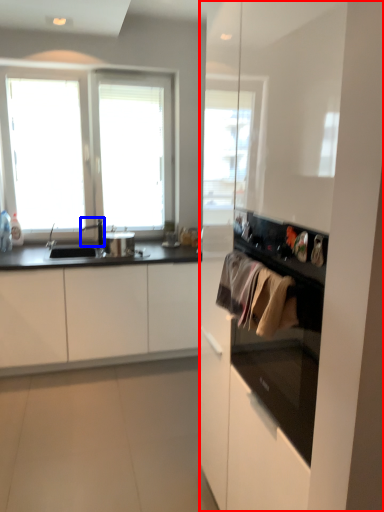
Question: Which object is closer to the camera taking this photo, dresser (highlighted by a red box) or faucet (highlighted by a blue box)?

Choices:
 (A) dresser
 (B) faucet

Answer: (A)